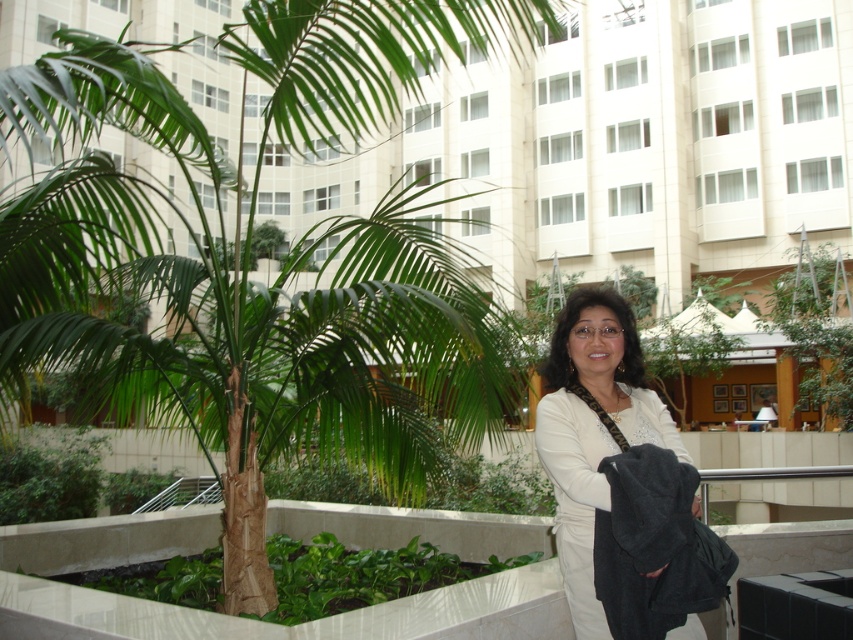
Question: Among these points, which one is farthest from the camera?

Choices:
 (A) (357, 93)
 (B) (642, 416)

Answer: (A)

Question: Can you confirm if green leafy palm tree at center is positioned to the left of white matte jacket at center?

Choices:
 (A) yes
 (B) no

Answer: (A)

Question: Does green leafy palm tree at center lie behind white matte jacket at center?

Choices:
 (A) no
 (B) yes

Answer: (A)

Question: Does green leafy palm tree at center have a greater width compared to white matte jacket at center?

Choices:
 (A) yes
 (B) no

Answer: (A)

Question: Among these points, which one is farthest from the camera?

Choices:
 (A) (151, 360)
 (B) (680, 456)

Answer: (A)